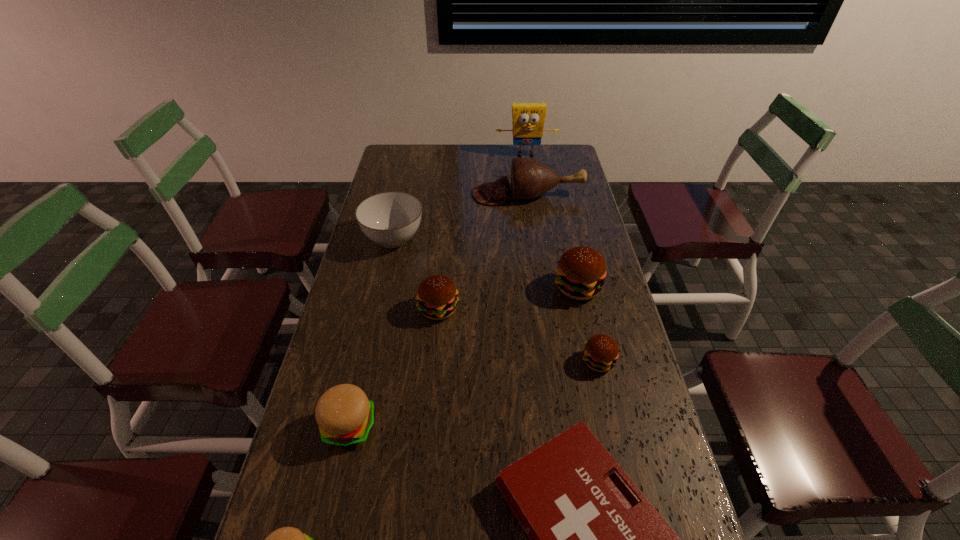
In the image, there is a desktop. What are the coordinates of `free region at the far right corner` in the screenshot? It's located at (573, 160).

Find the location of a particular element. free space between the third farthest object and the farthest object is located at coordinates (460, 197).

Locate an element on the screen. This screenshot has height=540, width=960. free space between the bigger beige hamburger and the chinaware is located at coordinates (372, 332).

Locate an element on the screen. The height and width of the screenshot is (540, 960). vacant space that is in between the leftmost brown hamburger and the sponge is located at coordinates (482, 232).

Locate an element on the screen. empty space that is in between the tallest hamburger and the leftmost brown hamburger is located at coordinates (508, 298).

This screenshot has width=960, height=540. What are the coordinates of `free space between the third farthest object and the fourth farthest hamburger` in the screenshot? It's located at (372, 332).

This screenshot has height=540, width=960. Identify the location of free spot between the third hamburger from left to right and the third nearest hamburger. (518, 335).

Select which object appears as the sixth closest to the sixth farthest object. Please provide its 2D coordinates. Your answer should be formatted as a tuple, i.e. [(x, y)], where the tuple contains the x and y coordinates of a point satisfying the conditions above.

[(530, 179)]

At what (x,y) coordinates should I click in order to perform the action: click on the third closest object to the sponge. Please return your answer as a coordinate pair (x, y). The width and height of the screenshot is (960, 540). Looking at the image, I should click on (581, 271).

The width and height of the screenshot is (960, 540). I want to click on the second closest hamburger to the nearer beige hamburger, so click(x=437, y=297).